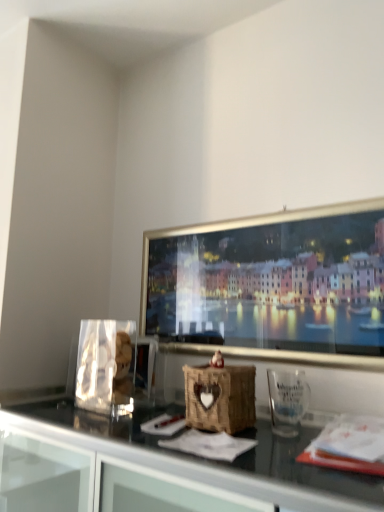
Where is `transparent plastic glass at lower right`? The height and width of the screenshot is (512, 384). transparent plastic glass at lower right is located at coordinates (287, 401).

The height and width of the screenshot is (512, 384). What do you see at coordinates (287, 401) in the screenshot? I see `transparent plastic glass at lower right` at bounding box center [287, 401].

What do you see at coordinates (220, 397) in the screenshot?
I see `woven wood basket at center` at bounding box center [220, 397].

Locate an element on the screen. Image resolution: width=384 pixels, height=512 pixels. woven wood basket at center is located at coordinates (220, 397).

Find the location of a particular element. The image size is (384, 512). transparent plastic glass at lower right is located at coordinates (287, 401).

Considering the relative positions of transparent plastic glass at lower right and woven wood basket at center in the image provided, is transparent plastic glass at lower right to the left of woven wood basket at center from the viewer's perspective?

Incorrect, transparent plastic glass at lower right is not on the left side of woven wood basket at center.

Is transparent plastic glass at lower right behind woven wood basket at center?

No, it is not.

Does point (302, 398) come in front of point (201, 406)?

No.

From the image's perspective, which one is positioned lower, transparent plastic glass at lower right or woven wood basket at center?

From the image's view, woven wood basket at center is below.

From a real-world perspective, is transparent plastic glass at lower right below woven wood basket at center?

No, from a real-world perspective, transparent plastic glass at lower right is not beneath woven wood basket at center.

Based on the photo, which of these two, transparent plastic glass at lower right or woven wood basket at center, is wider?

woven wood basket at center is wider.

From the picture: Which of these two, transparent plastic glass at lower right or woven wood basket at center, stands taller?

Standing taller between the two is woven wood basket at center.

Is transparent plastic glass at lower right bigger or smaller than woven wood basket at center?

Clearly, transparent plastic glass at lower right is smaller in size than woven wood basket at center.

Is woven wood basket at center completely or partially inside transparent plastic glass at lower right?

No, woven wood basket at center is not inside transparent plastic glass at lower right.

Is transparent plastic glass at lower right with woven wood basket at center?

No, transparent plastic glass at lower right is not touching woven wood basket at center.

Could you tell me if transparent plastic glass at lower right is facing woven wood basket at center?

No, transparent plastic glass at lower right does not turn towards woven wood basket at center.

Looking at this image, how different are the orientations of transparent plastic glass at lower right and woven wood basket at center in degrees?

The facing directions of transparent plastic glass at lower right and woven wood basket at center are 5.97 degrees apart.

Where is `basket behind the transparent plastic glass at lower right`? This screenshot has height=512, width=384. basket behind the transparent plastic glass at lower right is located at coordinates (220, 397).

In the scene shown: Is woven wood basket at center at the right side of transparent plastic glass at lower right?

In fact, woven wood basket at center is to the left of transparent plastic glass at lower right.

Considering the relative positions of woven wood basket at center and transparent plastic glass at lower right in the image provided, is woven wood basket at center in front of transparent plastic glass at lower right?

No, it is behind transparent plastic glass at lower right.

Is point (221, 403) more distant than point (276, 400)?

That is False.

From the image's perspective, between woven wood basket at center and transparent plastic glass at lower right, which one is located above?

transparent plastic glass at lower right.

In the scene shown: From a real-world perspective, is woven wood basket at center beneath transparent plastic glass at lower right?

Yes.

Considering the sizes of objects woven wood basket at center and transparent plastic glass at lower right in the image provided, who is thinner, woven wood basket at center or transparent plastic glass at lower right?

With smaller width is transparent plastic glass at lower right.

Considering the relative sizes of woven wood basket at center and transparent plastic glass at lower right in the image provided, is woven wood basket at center taller than transparent plastic glass at lower right?

Yes, woven wood basket at center is taller than transparent plastic glass at lower right.

Considering the relative sizes of woven wood basket at center and transparent plastic glass at lower right in the image provided, is woven wood basket at center bigger than transparent plastic glass at lower right?

Yes, woven wood basket at center is bigger than transparent plastic glass at lower right.

Would you say woven wood basket at center contains transparent plastic glass at lower right?

No, transparent plastic glass at lower right is not surrounded by woven wood basket at center.

In the scene shown: Is woven wood basket at center far away from transparent plastic glass at lower right?

woven wood basket at center is near transparent plastic glass at lower right, not far away.

Could you tell me if woven wood basket at center is turned towards transparent plastic glass at lower right?

No, woven wood basket at center is not facing towards transparent plastic glass at lower right.

How many degrees apart are the facing directions of woven wood basket at center and transparent plastic glass at lower right?

The angular difference between woven wood basket at center and transparent plastic glass at lower right is 5.97 degrees.

At what (x,y) coordinates should I click in order to perform the action: click on basket behind the transparent plastic glass at lower right. Please return your answer as a coordinate pair (x, y). Image resolution: width=384 pixels, height=512 pixels. Looking at the image, I should click on [x=220, y=397].

You are a GUI agent. You are given a task and a screenshot of the screen. Output one action in this format:
    pyautogui.click(x=<x>, y=<y>)
    Task: Click on the glass vase lying above the woven wood basket at center (from the image's perspective)
    
    Given the screenshot: What is the action you would take?
    pyautogui.click(x=287, y=401)

Locate an element on the screen. basket below the transparent plastic glass at lower right (from a real-world perspective) is located at coordinates (220, 397).